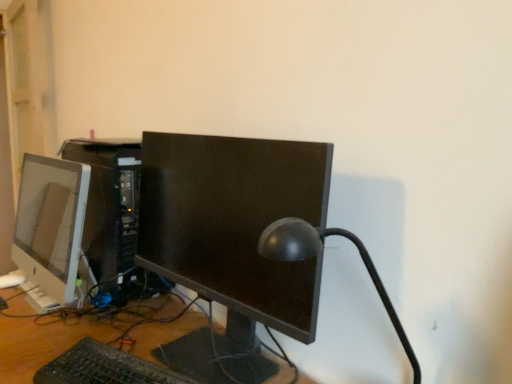
Question: Would you say satin black lamp at center is to the left or to the right of satin black computer tower at center in the picture?

Choices:
 (A) right
 (B) left

Answer: (A)

Question: Relative to satin black computer tower at center, is satin black lamp at center in front or behind?

Choices:
 (A) behind
 (B) front

Answer: (B)

Question: Estimate the real-world distances between objects in this image. Which object is closer to the satin white monitor at left, which is counted as the second computer monitor, starting from the right?

Choices:
 (A) satin black lamp at center
 (B) satin black computer tower at center
 (C) black plastic keyboard at lower center
 (D) wooden desk at center
 (E) matte black monitor at center, the second computer monitor from the left

Answer: (B)

Question: Which object is the closest to the satin white monitor at left, arranged as the first computer monitor when viewed from the left?

Choices:
 (A) wooden desk at center
 (B) satin black computer tower at center
 (C) matte black monitor at center, the second computer monitor from the left
 (D) black plastic keyboard at lower center
 (E) satin black lamp at center

Answer: (B)